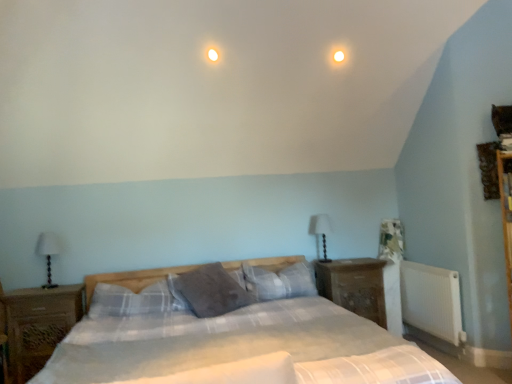
Question: Is plaid fabric bed at center located outside white fabric-covered table lamp at center-right, the 1th table lamp when ordered from back to front?

Choices:
 (A) no
 (B) yes

Answer: (B)

Question: From the image's perspective, is plaid fabric bed at center located above white fabric-covered table lamp at center-right, the second table lamp from the front?

Choices:
 (A) yes
 (B) no

Answer: (B)

Question: From a real-world perspective, is plaid fabric bed at center positioned over white fabric-covered table lamp at center-right, which is the first table lamp from right to left, based on gravity?

Choices:
 (A) yes
 (B) no

Answer: (B)

Question: Does plaid fabric bed at center have a greater width compared to white fabric-covered table lamp at center-right, the second table lamp from the front?

Choices:
 (A) no
 (B) yes

Answer: (B)

Question: Is plaid fabric bed at center bigger than white fabric-covered table lamp at center-right, which is the first table lamp from right to left?

Choices:
 (A) no
 (B) yes

Answer: (B)

Question: Could you tell me if plaid fabric bed at center is turned towards white fabric-covered table lamp at center-right, the second table lamp from the front?

Choices:
 (A) yes
 (B) no

Answer: (B)

Question: Is wooden nightstand at right, which is the 1th nightstand in back-to-front order, bigger than plaid fabric pillow at center, marked as the third pillow in a left-to-right arrangement?

Choices:
 (A) no
 (B) yes

Answer: (B)

Question: Does wooden nightstand at right, the 2th nightstand from the left, appear on the right side of plaid fabric pillow at center, marked as the third pillow in a left-to-right arrangement?

Choices:
 (A) no
 (B) yes

Answer: (B)

Question: Is wooden nightstand at right, which is counted as the first nightstand, starting from the right, far away from plaid fabric pillow at center, marked as the third pillow in a left-to-right arrangement?

Choices:
 (A) no
 (B) yes

Answer: (A)

Question: Is wooden nightstand at right, the 2th nightstand from the left, aimed at plaid fabric pillow at center, marked as the third pillow in a left-to-right arrangement?

Choices:
 (A) yes
 (B) no

Answer: (B)

Question: Is wooden nightstand at right, arranged as the 2th nightstand when viewed from the front, closer to the viewer compared to plaid fabric pillow at center, marked as the third pillow in a left-to-right arrangement?

Choices:
 (A) no
 (B) yes

Answer: (A)

Question: Considering the relative positions of wooden nightstand at right, which is counted as the first nightstand, starting from the right, and plaid fabric pillow at center, marked as the third pillow in a left-to-right arrangement, in the image provided, is wooden nightstand at right, which is counted as the first nightstand, starting from the right, to the left of plaid fabric pillow at center, marked as the third pillow in a left-to-right arrangement, from the viewer's perspective?

Choices:
 (A) yes
 (B) no

Answer: (B)

Question: From a real-world perspective, is plaid fabric pillow at center, the 1th pillow positioned from the right, on white fabric-covered table lamp at center-right, the second table lamp from the front?

Choices:
 (A) no
 (B) yes

Answer: (A)